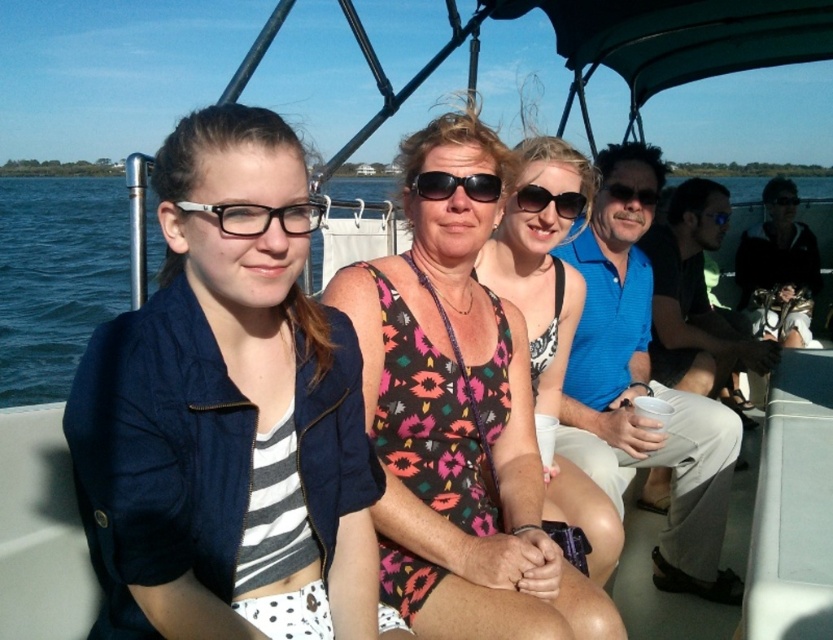
You are a photographer trying to capture a clear photo of the floral print tank top at center and the black plastic sunglasses at center. Based on their positions, which object is closer to the camera?

The floral print tank top at center is closer to the camera because it is in front of the black plastic sunglasses at center.

You are a photographer trying to capture a closeup of the two items at the center of the scene. The floral print tank top at center and the black plastic sunglasses at center. Since you can only focus on one item at a time, which item should you choose to ensure it fills more of the frame?

The floral print tank top at center should be chosen because its width is greater than the black plastic sunglasses at center, making it larger and thus better suited to fill the frame.

You are a photographer trying to capture a photo of the scene. You notice two pairs of eyewear in the image. Which pair is closer to the bottom of the photo, the matte black glasses at upper left or the sunglasses at center?

The matte black glasses at upper left is positioned under the sunglasses at center, so it is closer to the bottom of the photo.